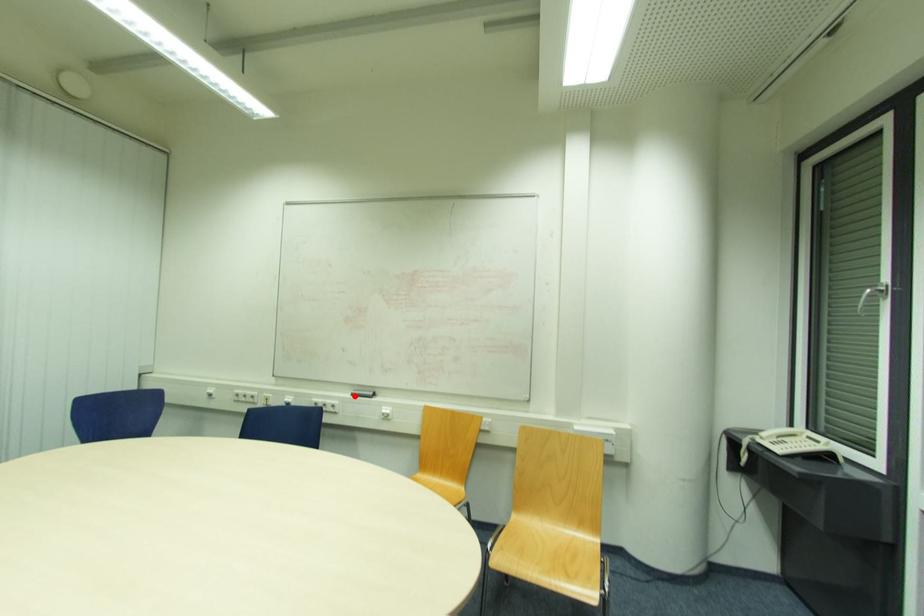
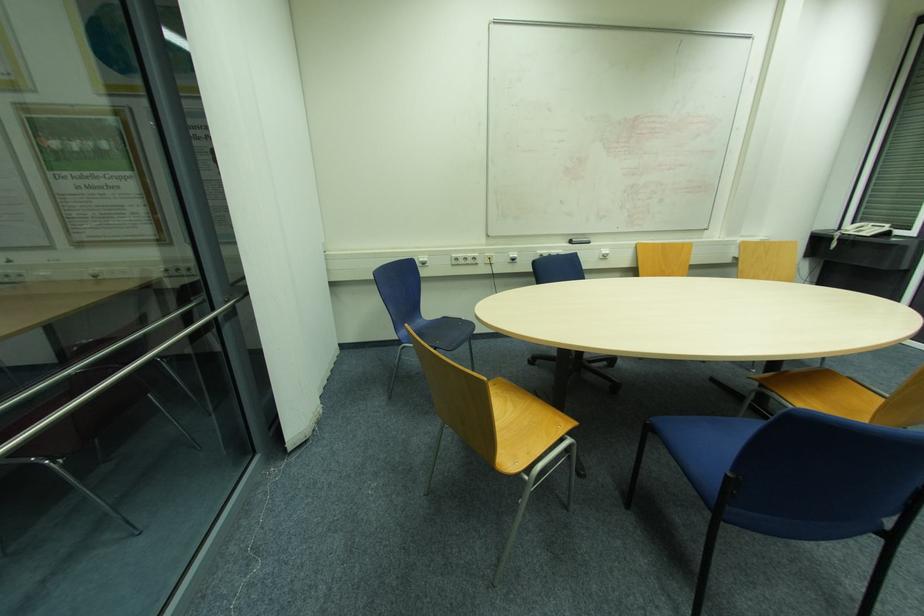
In the second image, find the point that corresponds to the highlighted location in the first image.

(574, 244)